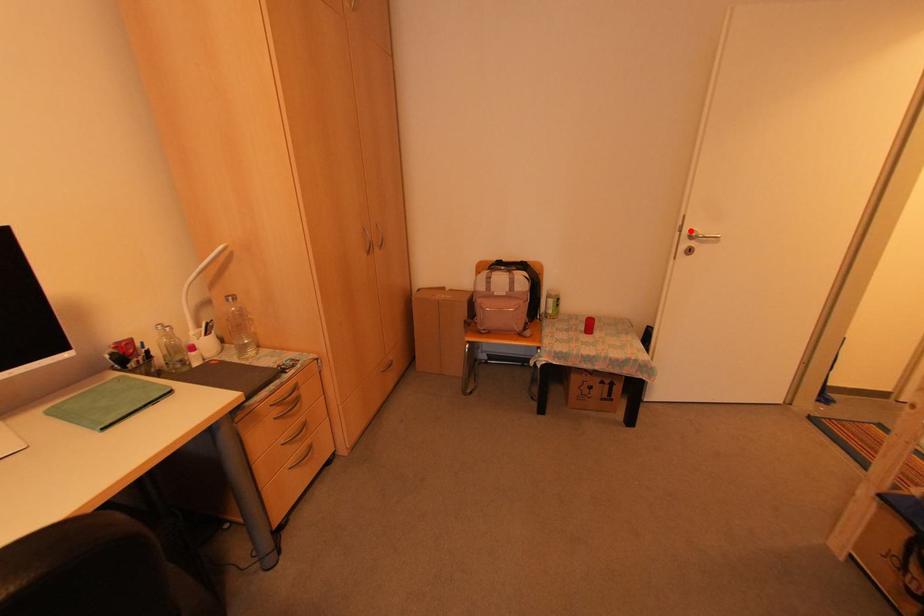
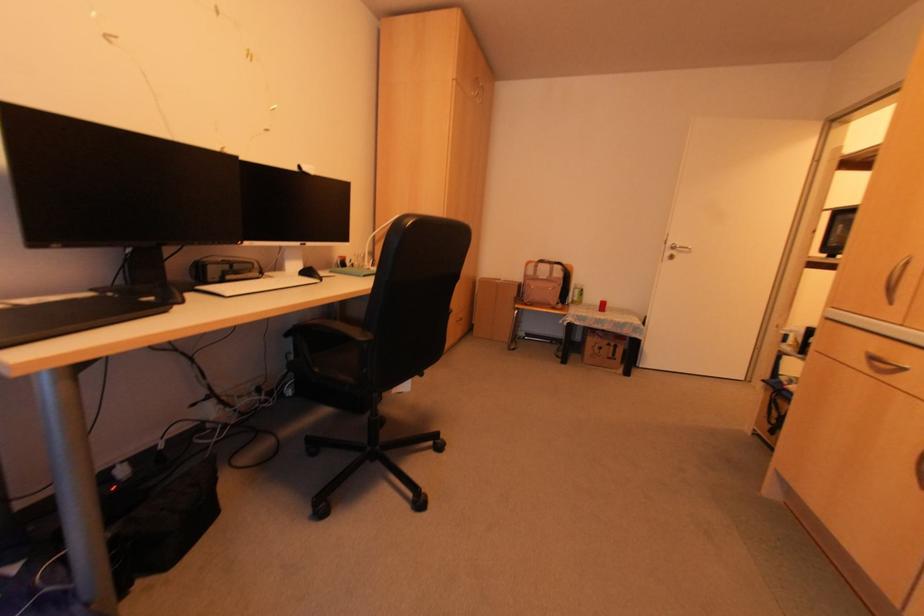
Question: I am providing you with two images of the same scene from different viewpoints. In image1, a red point is highlighted. Considering the same 3D point in image2, which of the following is correct?

Choices:
 (A) It is closer
 (B) It is farther

Answer: (A)